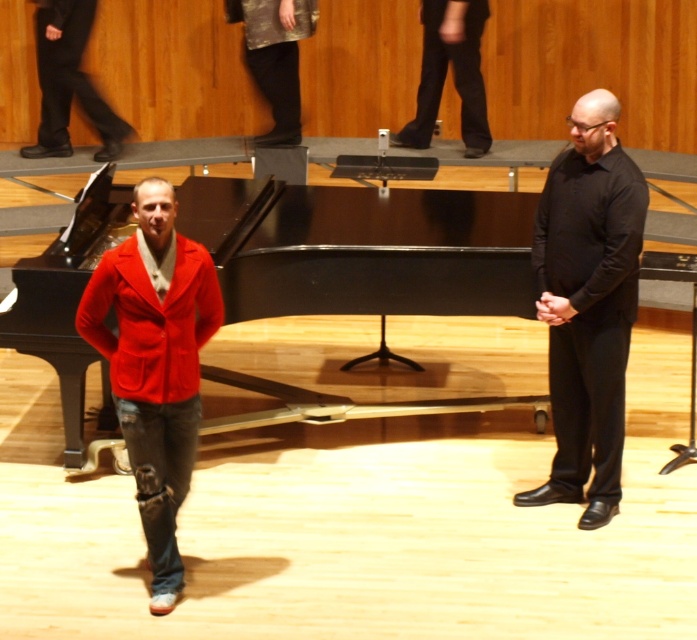
Which is more to the left, black smooth shirt at right or matte red blazer at left?

matte red blazer at left

Who is more forward, (608, 276) or (122, 369)?

Point (122, 369) is more forward.

I want to click on black smooth shirt at right, so click(588, 304).

Is the position of denim jacket at left more distant than that of black smooth pants at upper center?

No, it is in front of black smooth pants at upper center.

Find the location of a particular element. denim jacket at left is located at coordinates (68, 81).

Can you confirm if matte red blazer at left is thinner than matte red jacket at left?

Yes.

Does point (132, 401) come farther from viewer compared to point (139, 332)?

Yes, point (132, 401) is behind point (139, 332).

Identify the location of matte red blazer at left. Image resolution: width=697 pixels, height=640 pixels. (155, 364).